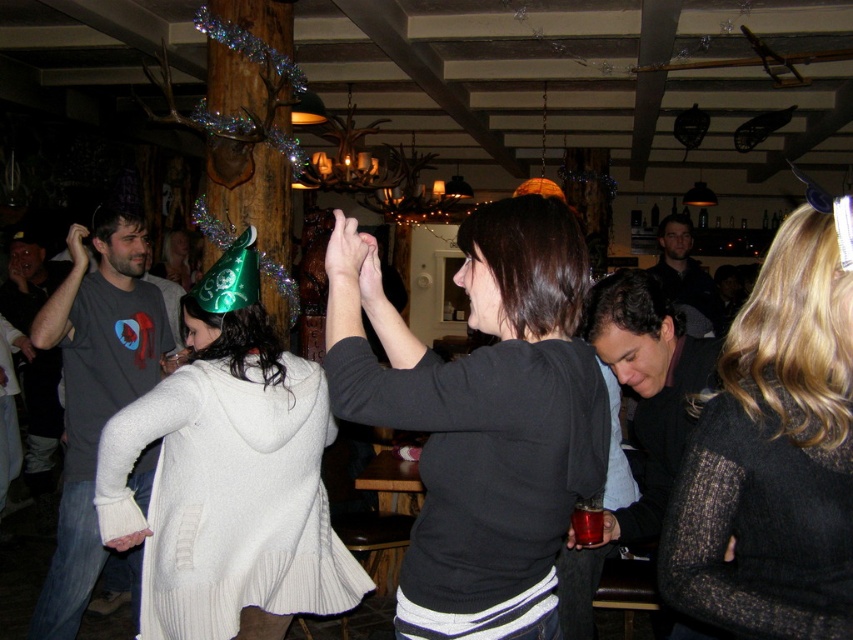
Is black matte sweater at center bigger than white knitted sweater at center?

No, black matte sweater at center is not bigger than white knitted sweater at center.

Does black matte sweater at center have a lesser height compared to white knitted sweater at center?

Correct, black matte sweater at center is not as tall as white knitted sweater at center.

Which is in front, point (428, 531) or point (318, 428)?

Positioned in front is point (428, 531).

What are the coordinates of `black matte sweater at center` in the screenshot? It's located at [x=480, y=417].

Locate an element on the screen. black matte sweater at center is located at coordinates (480, 417).

Who is more distant from viewer, (415, 362) or (833, 579)?

The point (415, 362) is behind.

At what (x,y) coordinates should I click in order to perform the action: click on black matte sweater at center. Please return your answer as a coordinate pair (x, y). This screenshot has width=853, height=640. Looking at the image, I should click on (480, 417).

Who is more forward, (296, 460) or (773, 608)?

Positioned in front is point (773, 608).

Looking at this image, does white knitted sweater at center appear on the right side of black textured sweater at right?

In fact, white knitted sweater at center is to the left of black textured sweater at right.

Which is in front, point (221, 472) or point (738, 380)?

Point (738, 380) is more forward.

I want to click on white knitted sweater at center, so click(x=229, y=476).